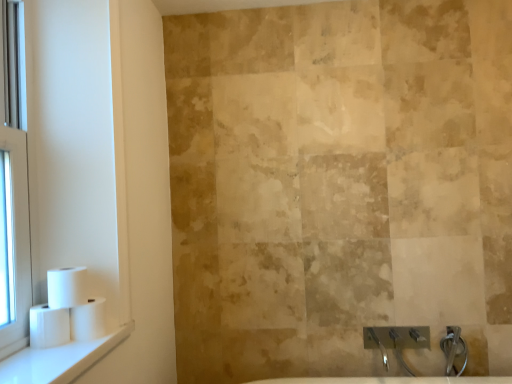
Question: Does clear glass window at left have a greater height compared to white glossy window sill at lower left?

Choices:
 (A) no
 (B) yes

Answer: (B)

Question: Is clear glass window at left not inside white glossy window sill at lower left?

Choices:
 (A) no
 (B) yes

Answer: (B)

Question: Is clear glass window at left further to the viewer compared to white glossy window sill at lower left?

Choices:
 (A) yes
 (B) no

Answer: (A)

Question: Considering the relative positions of clear glass window at left and white glossy window sill at lower left in the image provided, is clear glass window at left to the right of white glossy window sill at lower left from the viewer's perspective?

Choices:
 (A) yes
 (B) no

Answer: (B)

Question: Could you tell me if clear glass window at left is facing white glossy window sill at lower left?

Choices:
 (A) no
 (B) yes

Answer: (B)

Question: Is white matte toilet paper at left, which ranks as the 1th toilet paper in right-to-left order, to the left or to the right of white plastic toilet paper rolls at left in the image?

Choices:
 (A) left
 (B) right

Answer: (A)

Question: Would you say white matte toilet paper at left, which ranks as the 1th toilet paper in right-to-left order, is inside or outside white plastic toilet paper rolls at left?

Choices:
 (A) inside
 (B) outside

Answer: (B)

Question: Does point (96, 307) appear closer or farther from the camera than point (116, 150)?

Choices:
 (A) farther
 (B) closer

Answer: (B)

Question: Based on their sizes in the image, would you say white matte toilet paper at left, which ranks as the 1th toilet paper in right-to-left order, is bigger or smaller than white plastic toilet paper rolls at left?

Choices:
 (A) big
 (B) small

Answer: (B)

Question: Choose the correct answer: Is clear glass window at left inside white matte toilet paper at left, which is counted as the 2th toilet paper, starting from the left, or outside it?

Choices:
 (A) inside
 (B) outside

Answer: (B)

Question: Considering the positions of clear glass window at left and white matte toilet paper at left, the second toilet paper positioned from the right, in the image, is clear glass window at left taller or shorter than white matte toilet paper at left, the second toilet paper positioned from the right,?

Choices:
 (A) tall
 (B) short

Answer: (A)

Question: Is clear glass window at left in front of or behind white matte toilet paper at left, the second toilet paper positioned from the right, in the image?

Choices:
 (A) behind
 (B) front

Answer: (B)

Question: In terms of size, does clear glass window at left appear bigger or smaller than white matte toilet paper at left, the second toilet paper positioned from the right?

Choices:
 (A) big
 (B) small

Answer: (A)

Question: Considering the positions of point (31, 349) and point (49, 182), is point (31, 349) closer or farther from the camera than point (49, 182)?

Choices:
 (A) farther
 (B) closer

Answer: (B)

Question: Based on their sizes in the image, would you say white glossy window sill at lower left is bigger or smaller than white plastic toilet paper rolls at left?

Choices:
 (A) big
 (B) small

Answer: (B)